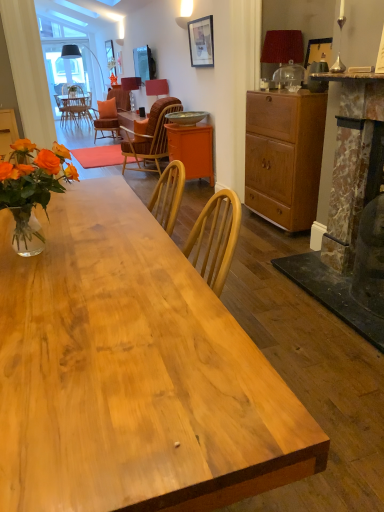
Question: From a real-world perspective, is natural wood desk at center positioned over orange matte cabinet at center, the second cabinetry from the front, based on gravity?

Choices:
 (A) no
 (B) yes

Answer: (B)

Question: Considering the relative sizes of natural wood desk at center and orange matte cabinet at center, the second cabinetry from the front, in the image provided, is natural wood desk at center wider than orange matte cabinet at center, the second cabinetry from the front,?

Choices:
 (A) no
 (B) yes

Answer: (B)

Question: From a real-world perspective, is natural wood desk at center under orange matte cabinet at center, the 1th cabinetry in the back-to-front sequence?

Choices:
 (A) no
 (B) yes

Answer: (A)

Question: Is there a large distance between natural wood desk at center and orange matte cabinet at center, arranged as the second cabinetry when viewed from the right?

Choices:
 (A) no
 (B) yes

Answer: (B)

Question: Does natural wood desk at center come behind orange matte cabinet at center, the 1th cabinetry in the back-to-front sequence?

Choices:
 (A) no
 (B) yes

Answer: (A)

Question: From the image's perspective, is matte orange lampshade at center, marked as the first lamp in a back-to-front arrangement, positioned above or below natural wood desk at center?

Choices:
 (A) below
 (B) above

Answer: (B)

Question: Is matte orange lampshade at center, marked as the first lamp in a left-to-right arrangement, wider or thinner than natural wood desk at center?

Choices:
 (A) thin
 (B) wide

Answer: (A)

Question: Relative to natural wood desk at center, is matte orange lampshade at center, positioned as the 3th lamp in right-to-left order, in front or behind?

Choices:
 (A) behind
 (B) front

Answer: (A)

Question: Considering the relative positions of matte orange lampshade at center, the 3th lamp from the bottom, and natural wood desk at center in the image provided, is matte orange lampshade at center, the 3th lamp from the bottom, to the left or to the right of natural wood desk at center?

Choices:
 (A) left
 (B) right

Answer: (A)

Question: In the image, is red fabric lampshade at upper right, which appears as the 3th lamp when viewed from the back, on the left side or the right side of orange matte cabinet at center, the 1th cabinetry in the back-to-front sequence?

Choices:
 (A) right
 (B) left

Answer: (A)

Question: In terms of width, does red fabric lampshade at upper right, arranged as the 3th lamp when viewed from the left, look wider or thinner when compared to orange matte cabinet at center, the second cabinetry from the front?

Choices:
 (A) thin
 (B) wide

Answer: (A)

Question: Does point (274, 47) appear closer or farther from the camera than point (170, 139)?

Choices:
 (A) closer
 (B) farther

Answer: (A)

Question: Is red fabric lampshade at upper right, the third lamp positioned from the top, bigger or smaller than orange matte cabinet at center, arranged as the second cabinetry when viewed from the right?

Choices:
 (A) big
 (B) small

Answer: (B)

Question: From a real-world perspective, is metallic bowl at center above or below orange matte cabinet at center, the 1th cabinetry when ordered from left to right?

Choices:
 (A) above
 (B) below

Answer: (A)

Question: Considering the positions of metallic bowl at center and orange matte cabinet at center, the 1th cabinetry when ordered from left to right, in the image, is metallic bowl at center taller or shorter than orange matte cabinet at center, the 1th cabinetry when ordered from left to right,?

Choices:
 (A) short
 (B) tall

Answer: (A)